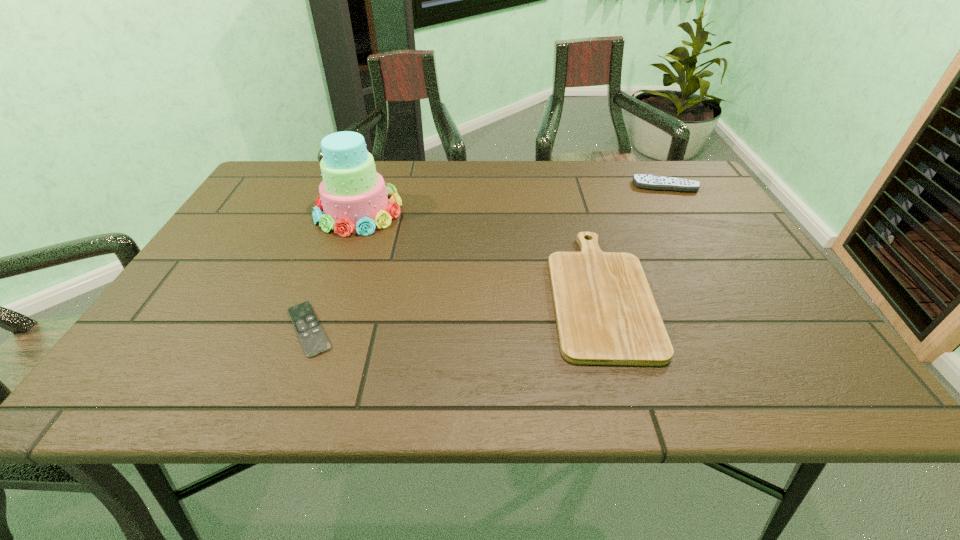
The height and width of the screenshot is (540, 960). I want to click on vacant region located on the left of the shortest object, so click(230, 329).

Locate an element on the screen. This screenshot has width=960, height=540. cake that is positioned at the far edge is located at coordinates (353, 195).

You are a GUI agent. You are given a task and a screenshot of the screen. Output one action in this format:
    pyautogui.click(x=<x>, y=<y>)
    Task: Click on the remote control that is at the far edge
    This screenshot has height=540, width=960.
    Given the screenshot: What is the action you would take?
    pyautogui.click(x=644, y=181)

Locate an element on the screen. object that is at the near edge is located at coordinates [606, 314].

You are a GUI agent. You are given a task and a screenshot of the screen. Output one action in this format:
    pyautogui.click(x=<x>, y=<y>)
    Task: Click on the object that is at the right edge
    The image size is (960, 540).
    Given the screenshot: What is the action you would take?
    pyautogui.click(x=644, y=181)

At what (x,y) coordinates should I click in order to perform the action: click on object positioned at the far right corner. Please return your answer as a coordinate pair (x, y). Looking at the image, I should click on (644, 181).

This screenshot has height=540, width=960. In order to click on vacant area at the far edge of the desktop in this screenshot , I will do `click(506, 182)`.

Where is `free region at the near edge of the desktop`? This screenshot has width=960, height=540. free region at the near edge of the desktop is located at coordinates (331, 374).

Locate an element on the screen. Image resolution: width=960 pixels, height=540 pixels. vacant area at the left edge of the desktop is located at coordinates (197, 277).

Find the location of a particular element. Image resolution: width=960 pixels, height=540 pixels. blank space at the right edge of the desktop is located at coordinates (695, 257).